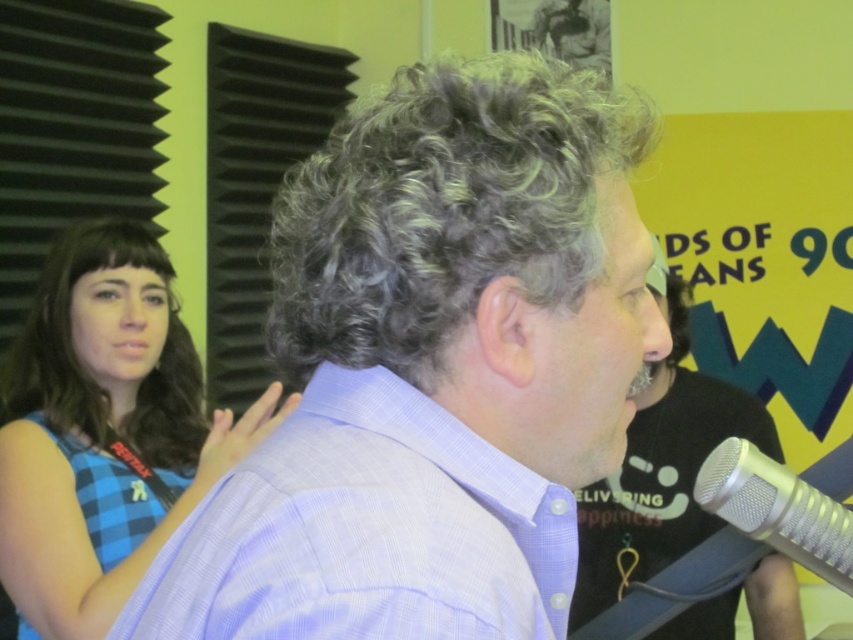
You are a guest at the radio station and want to know if the gray curly hair at center is larger than the silver metallic microphone at lower right. Can you confirm this?

The gray curly hair at center is bigger than the silver metallic microphone at lower right, so yes, the gray curly hair at center is larger than the silver metallic microphone at lower right.

You are designing a layout for a magazine cover featuring the two subjects from the image. The light blue plaid shirt at center and the blue shiny hair at left need to be placed side by side. Which object should be placed on the left side to ensure the thinner one is adjacent to the wider one?

The light blue plaid shirt at center is thinner than the blue shiny hair at left, so the thinner light blue plaid shirt at center should be placed on the left side next to the wider blue shiny hair at left.

You are standing at the camera position looking at the scene. There are two points marked in the image. The first point is at coordinates point (408, 131) and the second point is at point (740, 474). Which point is closer to you?

Point (408, 131) is closer to the camera than point (740, 474).